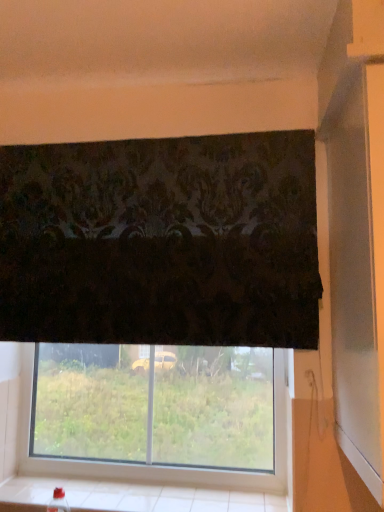
Question: In terms of height, does white tile at lower center look taller or shorter compared to transparent glass window at lower center?

Choices:
 (A) short
 (B) tall

Answer: (A)

Question: Is white tile at lower center wider or thinner than transparent glass window at lower center?

Choices:
 (A) wide
 (B) thin

Answer: (A)

Question: From a real-world perspective, is white tile at lower center physically located above or below transparent glass window at lower center?

Choices:
 (A) above
 (B) below

Answer: (B)

Question: Does point (283, 385) appear closer or farther from the camera than point (14, 483)?

Choices:
 (A) closer
 (B) farther

Answer: (A)

Question: Would you say transparent glass window at lower center is to the left or to the right of white tile at lower center in the picture?

Choices:
 (A) right
 (B) left

Answer: (A)

Question: From a real-world perspective, is transparent glass window at lower center physically located above or below white tile at lower center?

Choices:
 (A) below
 (B) above

Answer: (B)

Question: Looking at the image, does transparent glass window at lower center seem bigger or smaller compared to white tile at lower center?

Choices:
 (A) small
 (B) big

Answer: (B)